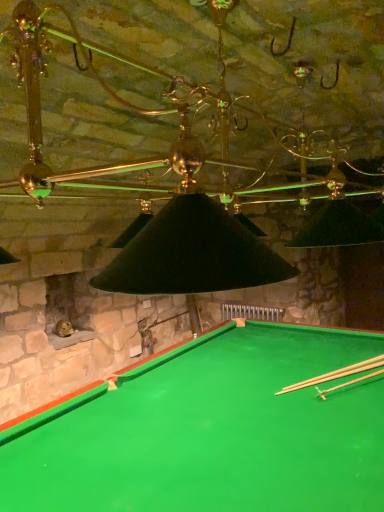
Question: Does light brown wooden cue at bottom right, which is counted as the 1th cue, starting from the front, contain smooth wood cue at bottom right, arranged as the first cue when viewed from the back?

Choices:
 (A) no
 (B) yes

Answer: (A)

Question: Is light brown wooden cue at bottom right, which is counted as the 1th cue, starting from the front, positioned with its back to smooth wood cue at bottom right, the 2th cue from the front?

Choices:
 (A) yes
 (B) no

Answer: (B)

Question: Is light brown wooden cue at bottom right, placed as the 2th cue when sorted from back to front, facing towards smooth wood cue at bottom right, the 2th cue from the front?

Choices:
 (A) no
 (B) yes

Answer: (A)

Question: From a real-world perspective, is light brown wooden cue at bottom right, placed as the 2th cue when sorted from back to front, located beneath smooth wood cue at bottom right, arranged as the first cue when viewed from the back?

Choices:
 (A) yes
 (B) no

Answer: (B)

Question: Is light brown wooden cue at bottom right, placed as the 2th cue when sorted from back to front, positioned beyond the bounds of smooth wood cue at bottom right, the 2th cue from the front?

Choices:
 (A) yes
 (B) no

Answer: (A)

Question: Does light brown wooden cue at bottom right, placed as the 2th cue when sorted from back to front, appear on the right side of smooth wood cue at bottom right, arranged as the first cue when viewed from the back?

Choices:
 (A) yes
 (B) no

Answer: (A)

Question: Is green felt billiard table at lower center shorter than light brown wooden cue at bottom right, which is counted as the 1th cue, starting from the front?

Choices:
 (A) no
 (B) yes

Answer: (A)

Question: Would you say green felt billiard table at lower center is a long distance from light brown wooden cue at bottom right, which is counted as the 1th cue, starting from the front?

Choices:
 (A) yes
 (B) no

Answer: (B)

Question: Is green felt billiard table at lower center touching light brown wooden cue at bottom right, placed as the 2th cue when sorted from back to front?

Choices:
 (A) yes
 (B) no

Answer: (B)

Question: Is light brown wooden cue at bottom right, which is counted as the 1th cue, starting from the front, inside green felt billiard table at lower center?

Choices:
 (A) no
 (B) yes

Answer: (B)

Question: From the image's perspective, is green felt billiard table at lower center beneath light brown wooden cue at bottom right, which is counted as the 1th cue, starting from the front?

Choices:
 (A) no
 (B) yes

Answer: (B)

Question: Does green felt billiard table at lower center have a smaller size compared to light brown wooden cue at bottom right, placed as the 2th cue when sorted from back to front?

Choices:
 (A) no
 (B) yes

Answer: (A)

Question: Is light brown wooden cue at bottom right, placed as the 2th cue when sorted from back to front, closer to the viewer compared to green felt billiard table at lower center?

Choices:
 (A) yes
 (B) no

Answer: (B)